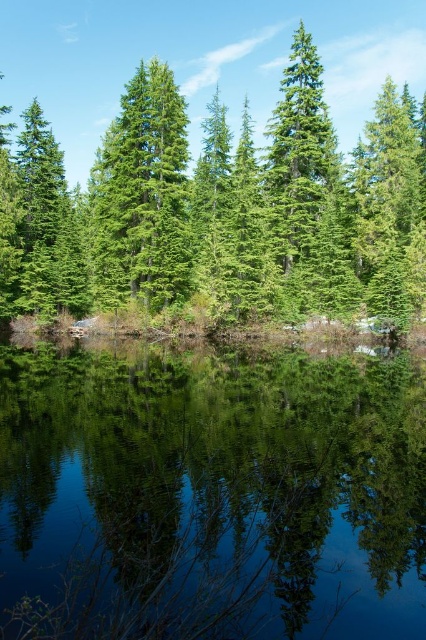
Does point (299, 248) come in front of point (146, 104)?

No.

Is point (17, 166) positioned after point (109, 163)?

That is True.

This screenshot has width=426, height=640. Identify the location of green needle-like trees at center. click(x=219, y=209).

Can you confirm if green reflective water at center is positioned below green matte tree at center?

Correct, green reflective water at center is located below green matte tree at center.

Between green reflective water at center and green matte tree at center, which one appears on the left side from the viewer's perspective?

Positioned to the left is green matte tree at center.

Does point (106, 346) lie behind point (112, 301)?

That is False.

You are a GUI agent. You are given a task and a screenshot of the screen. Output one action in this format:
    pyautogui.click(x=<x>, y=<y>)
    Task: Click on the green reflective water at center
    The height and width of the screenshot is (640, 426).
    Given the screenshot: What is the action you would take?
    pyautogui.click(x=210, y=493)

Can you confirm if green reflective water at center is taller than green needle-like trees at center?

No, green reflective water at center is not taller than green needle-like trees at center.

Is green reflective water at center smaller than green needle-like trees at center?

Indeed, green reflective water at center has a smaller size compared to green needle-like trees at center.

Who is more distant from viewer, (408, 515) or (342, 240)?

The point (342, 240) is behind.

Image resolution: width=426 pixels, height=640 pixels. In order to click on green reflective water at center in this screenshot , I will do `click(210, 493)`.